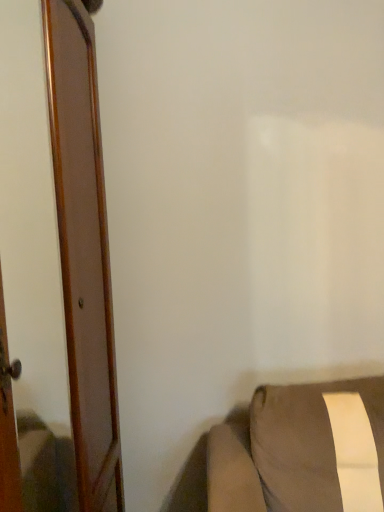
Question: From the image's perspective, relative to wooden door at left, is brown fabric cushion at lower right above or below?

Choices:
 (A) below
 (B) above

Answer: (A)

Question: Is brown fabric cushion at lower right in front of or behind wooden door at left in the image?

Choices:
 (A) behind
 (B) front

Answer: (A)

Question: Is brown fabric cushion at lower right wider or thinner than wooden door at left?

Choices:
 (A) wide
 (B) thin

Answer: (A)

Question: From the image's perspective, is wooden door at left positioned above or below brown fabric cushion at lower right?

Choices:
 (A) below
 (B) above

Answer: (B)

Question: Looking at the image, does wooden door at left seem bigger or smaller compared to brown fabric cushion at lower right?

Choices:
 (A) small
 (B) big

Answer: (B)

Question: From a real-world perspective, is wooden door at left positioned above or below brown fabric cushion at lower right?

Choices:
 (A) above
 (B) below

Answer: (A)

Question: In the image, is wooden door at left positioned in front of or behind brown fabric cushion at lower right?

Choices:
 (A) front
 (B) behind

Answer: (A)